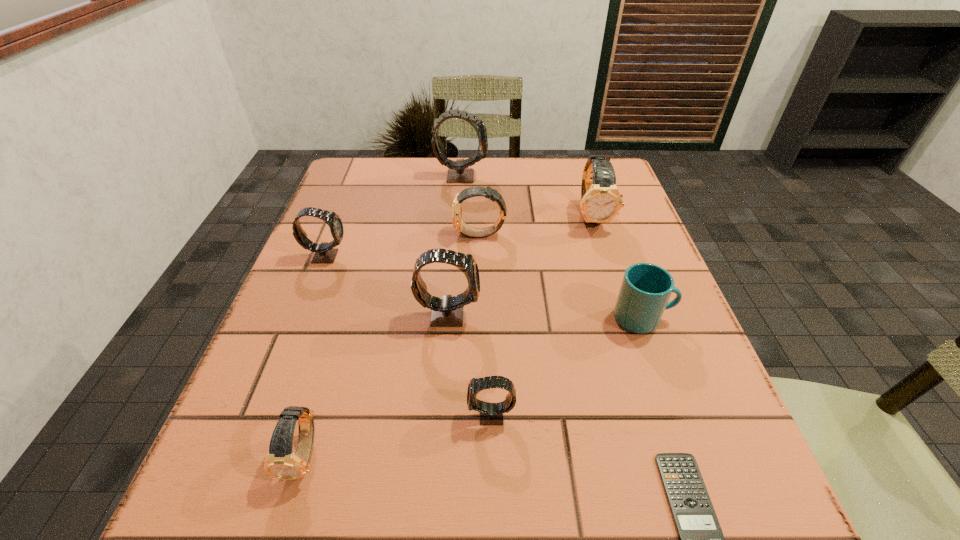
Where is `the nearest gray watch`? This screenshot has width=960, height=540. the nearest gray watch is located at coordinates (490, 413).

This screenshot has height=540, width=960. Find the location of `the second object from left to right`. the second object from left to right is located at coordinates (281, 462).

Find the location of `the nearest gold watch`. the nearest gold watch is located at coordinates (281, 462).

This screenshot has height=540, width=960. Find the location of `vacant space situated on the face of the farthest gray watch`. vacant space situated on the face of the farthest gray watch is located at coordinates (589, 176).

In order to click on vacant area situated on the face of the second nearest gray watch in this screenshot , I will do `click(564, 314)`.

I want to click on vacant position located on the face of the rightmost watch, so click(x=616, y=293).

Locate an element on the screen. This screenshot has width=960, height=540. vacant space situated on the face of the second gold watch from left to right is located at coordinates [x=368, y=235].

The image size is (960, 540). What are the coordinates of `vacant point located on the face of the second gold watch from left to right` in the screenshot? It's located at (342, 235).

Locate an element on the screen. The image size is (960, 540). blank space located on the face of the second gold watch from left to right is located at coordinates pos(354,235).

Where is `vacant space located on the face of the leftmost watch`? Image resolution: width=960 pixels, height=540 pixels. vacant space located on the face of the leftmost watch is located at coordinates (513, 256).